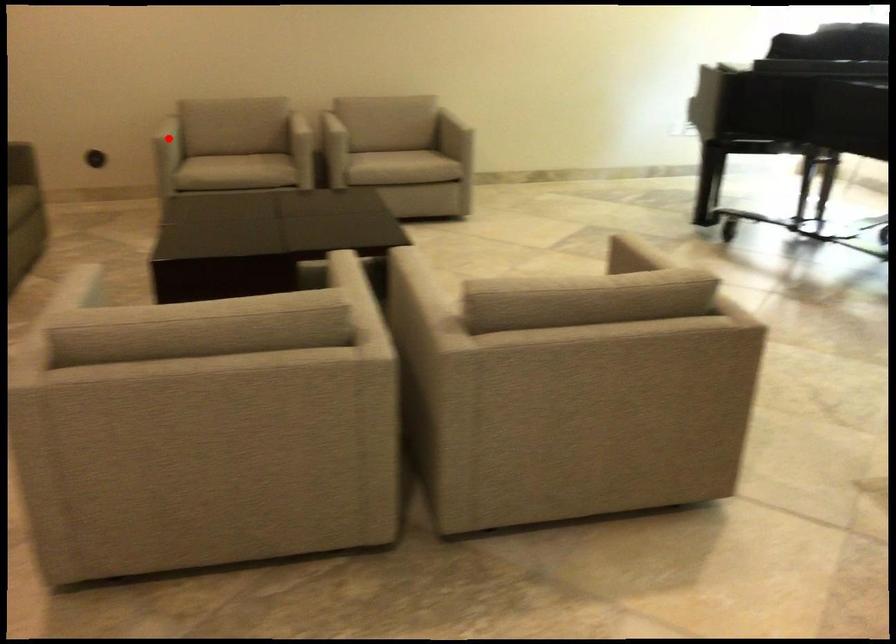
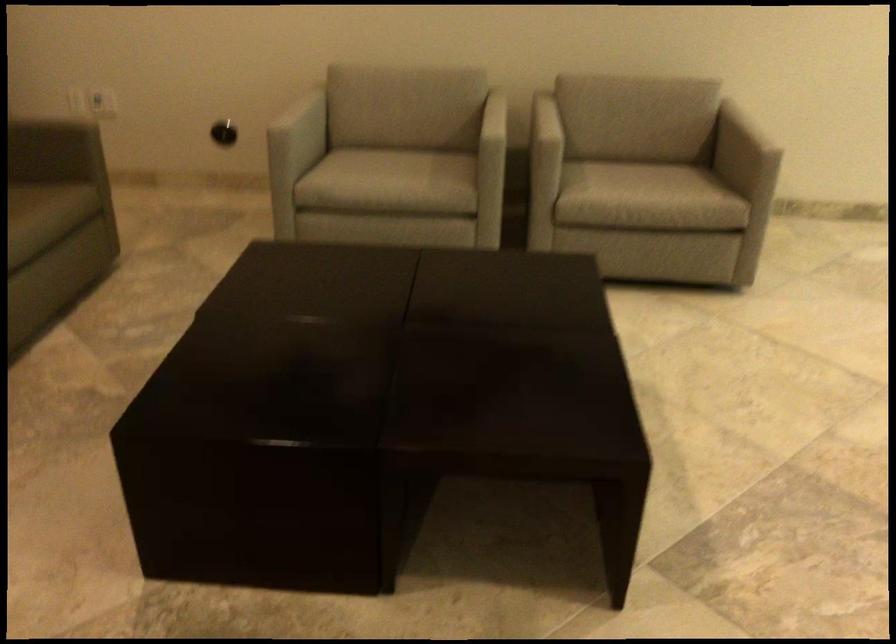
In the second image, find the point that corresponds to the highlighted location in the first image.

(304, 124)